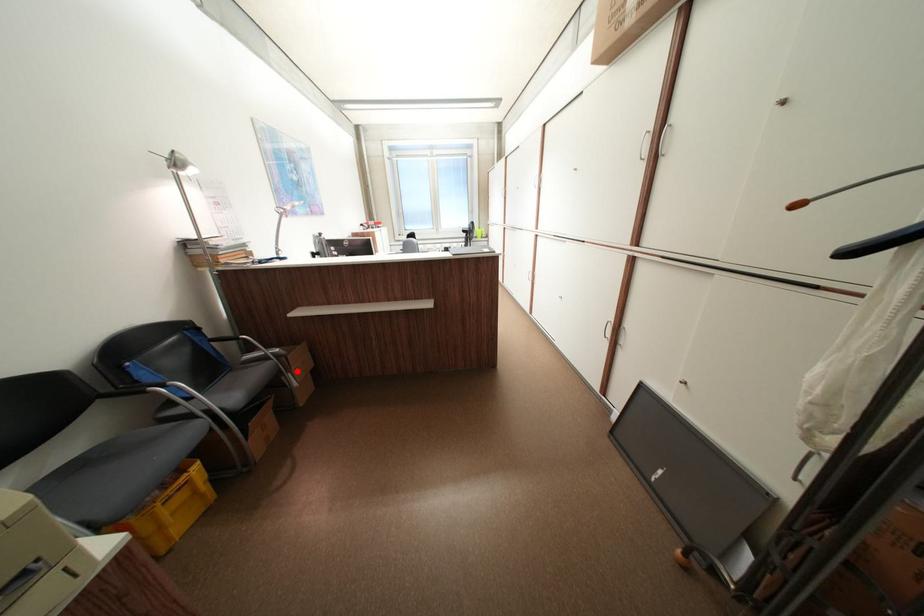
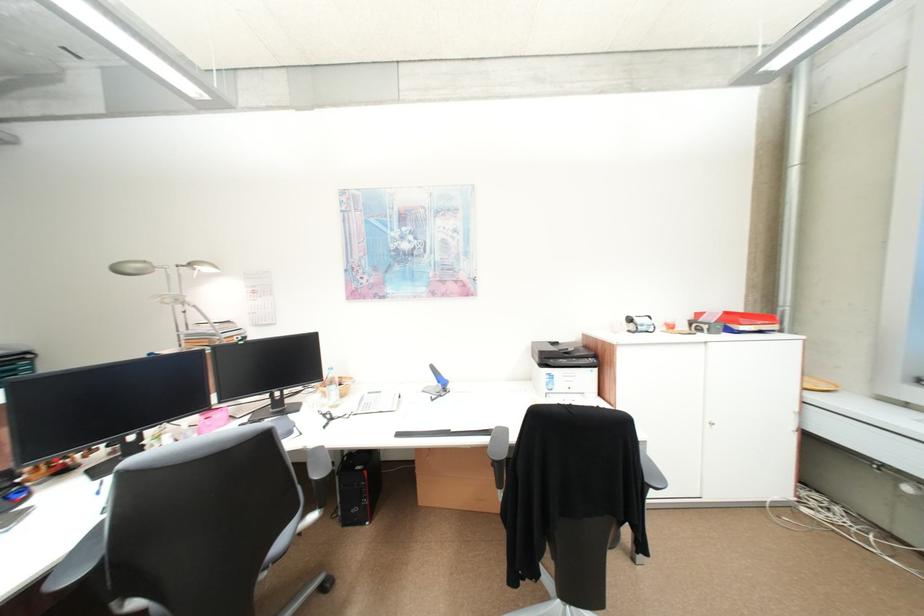
Question: I am providing you with two images of the same scene from different viewpoints. A red point is marked on the first image. Can you still see the location of the red point in image 2?

Choices:
 (A) Yes
 (B) No

Answer: (B)